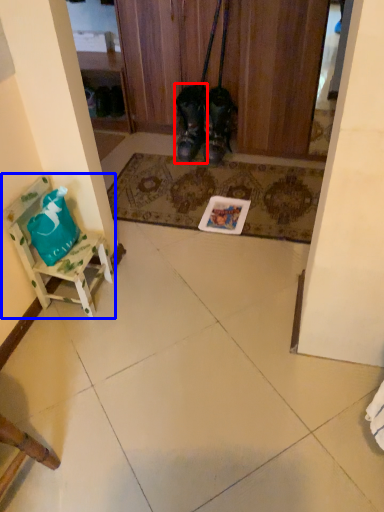
Question: Among these objects, which one is farthest to the camera, footwear (highlighted by a red box) or furniture (highlighted by a blue box)?

Choices:
 (A) footwear
 (B) furniture

Answer: (A)